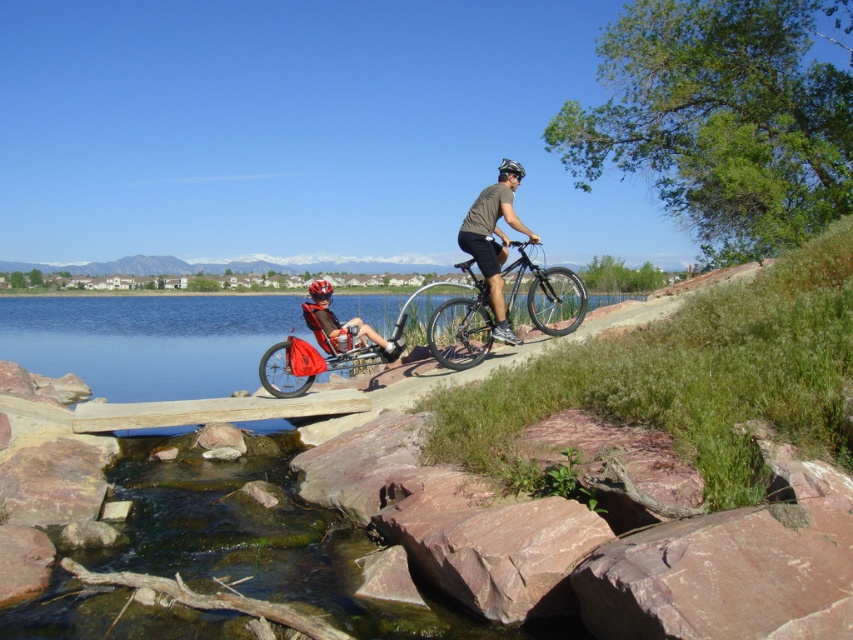
You are a hiker who wants to know which helmet is higher up in the scene. You see a red matte bicycle helmet at center and a black matte bicycle helmet at upper center. Which one is positioned higher?

The black matte bicycle helmet at upper center is positioned higher than the red matte bicycle helmet at center.

You are planning to take a photo of the scene. You want to ensure both the matte black bicycle at center and the red matte bicycle helmet at center are clearly visible. Which object should you focus on first to ensure proper focus, considering their sizes?

The matte black bicycle at center is bigger than the red matte bicycle helmet at center, so focusing on the larger object first would help ensure both are in focus.